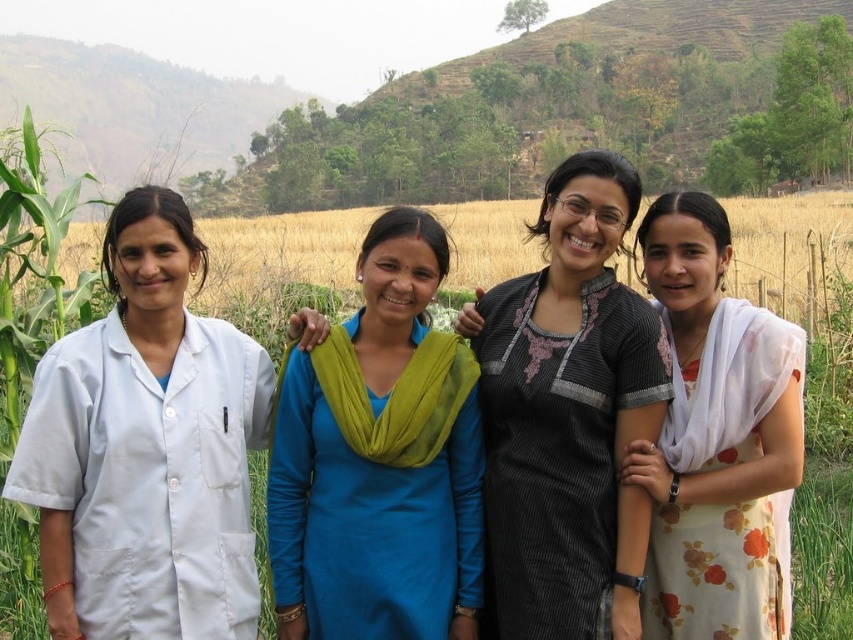
Based on the scene description, which dress is positioned to the left when comparing the black striped dress at center and the floral dress at right?

The black striped dress at center is positioned to the left of the floral dress at right according to the description.

You are a photographer who wants to ensure all subjects are visible in the photo. The black striped dress at center and floral dress at right are two of the women in the group. Given their sizes, which one might you need to adjust their position to prevent being obscured?

The black striped dress at center is larger in size than floral dress at right. Therefore, the photographer should position the black striped dress at center slightly behind the floral dress at right to ensure both are fully visible in the photo.